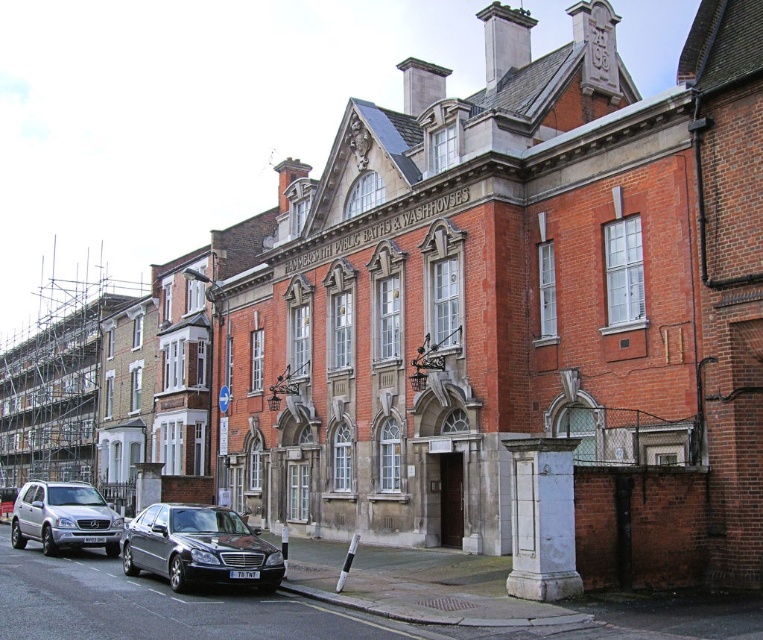
Between metal scaffolding at left and silver metallic suv at lower left, which one is positioned lower?

silver metallic suv at lower left is below.

What do you see at coordinates (55, 380) in the screenshot? The width and height of the screenshot is (763, 640). I see `metal scaffolding at left` at bounding box center [55, 380].

This screenshot has width=763, height=640. I want to click on metal scaffolding at left, so click(55, 380).

Where is `metal scaffolding at left`? The image size is (763, 640). metal scaffolding at left is located at coordinates (55, 380).

Consider the image. Is shiny black sedan at lower center bigger than silver metallic suv at lower left?

Indeed, shiny black sedan at lower center has a larger size compared to silver metallic suv at lower left.

The height and width of the screenshot is (640, 763). Describe the element at coordinates (198, 547) in the screenshot. I see `shiny black sedan at lower center` at that location.

Where is `shiny black sedan at lower center`? shiny black sedan at lower center is located at coordinates (198, 547).

Is metal scaffolding at left further to camera compared to shiny black sedan at lower center?

Yes, it is.

Find the location of a particular element. metal scaffolding at left is located at coordinates (55, 380).